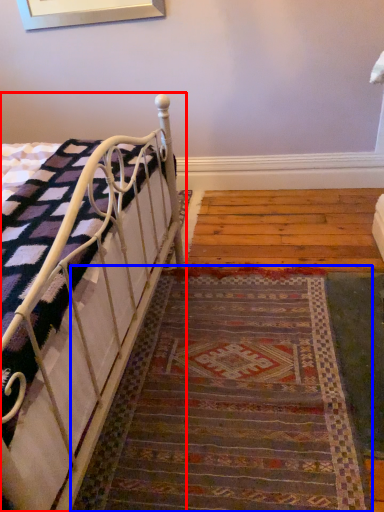
Question: Which of the following is the farthest to the observer, bed (highlighted by a red box) or doormat (highlighted by a blue box)?

Choices:
 (A) bed
 (B) doormat

Answer: (B)